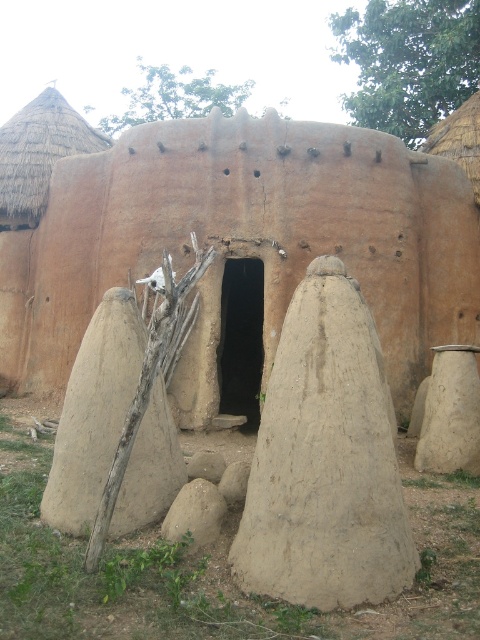
Between brown mud hut at center and beige clay pot at center, which one has less height?

beige clay pot at center is shorter.

Is brown mud hut at center bigger than beige clay pot at center?

Yes.

Is point (419, 381) more distant than point (84, 484)?

Yes, it is.

Identify the location of brown mud hut at center. This screenshot has height=640, width=480. (228, 241).

Does smooth clay pot at center have a smaller size compared to beige clay pot at center?

No.

Is smooth clay pot at center above beige clay pot at center?

Yes.

Does point (394, 596) come farther from viewer compared to point (67, 384)?

No, (394, 596) is in front of (67, 384).

You are a GUI agent. You are given a task and a screenshot of the screen. Output one action in this format:
    pyautogui.click(x=<x>, y=<y>)
    Task: Click on the smooth clay pot at center
    The image size is (480, 640).
    Given the screenshot: What is the action you would take?
    pyautogui.click(x=325, y=460)

Between beige clay pot at center and brown rough stone at center, which one is positioned higher?

beige clay pot at center is higher up.

Does beige clay pot at center appear on the left side of brown rough stone at center?

Indeed, beige clay pot at center is positioned on the left side of brown rough stone at center.

Is point (171, 433) positioned behind point (219, 460)?

No, it is not.

The image size is (480, 640). Identify the location of beige clay pot at center. (94, 412).